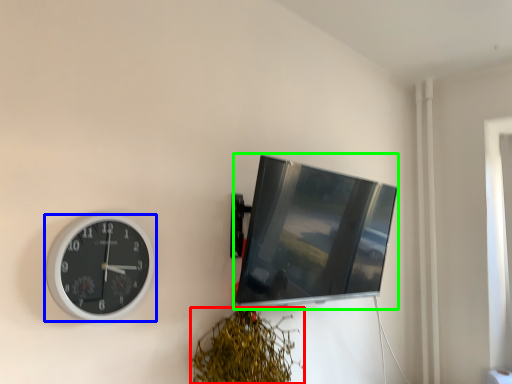
Question: Estimate the real-world distances between objects in this image. Which object is farther from vegetation (highlighted by a red box), wall clock (highlighted by a blue box) or computer monitor (highlighted by a green box)?

Choices:
 (A) wall clock
 (B) computer monitor

Answer: (A)